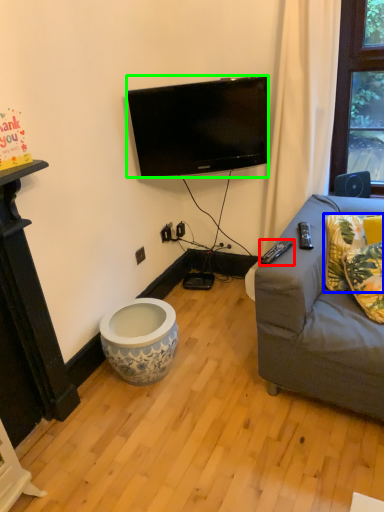
Question: Estimate the real-world distances between objects in this image. Which object is closer to remote control (highlighted by a red box), pillow (highlighted by a blue box) or television (highlighted by a green box)?

Choices:
 (A) pillow
 (B) television

Answer: (A)